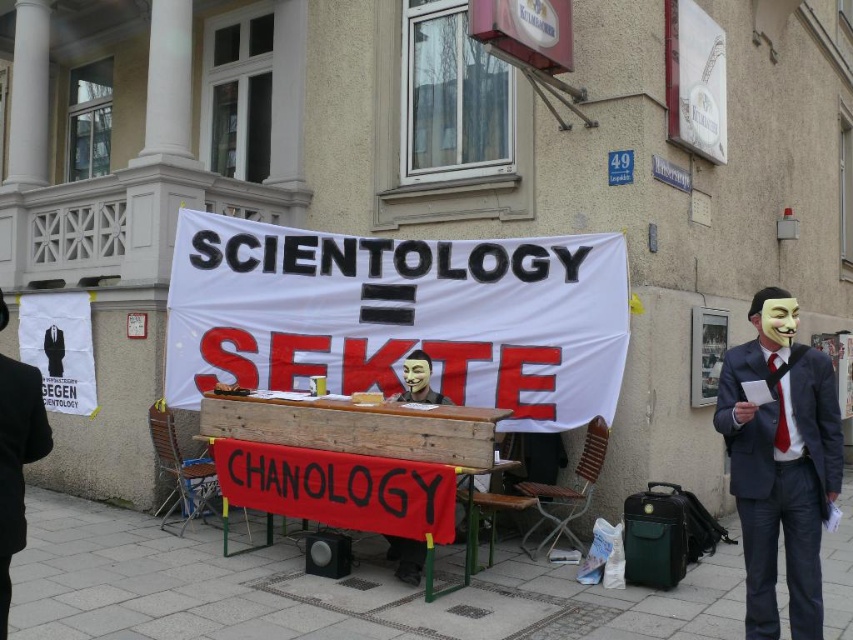
You are a photographer positioned at the front of the protest area. You need to capture a photo that includes both the matte black suit at right and the black suit at center. Which one of the two suits is closer to the camera?

The matte black suit at right is closer to the camera because the black suit at center is behind it.